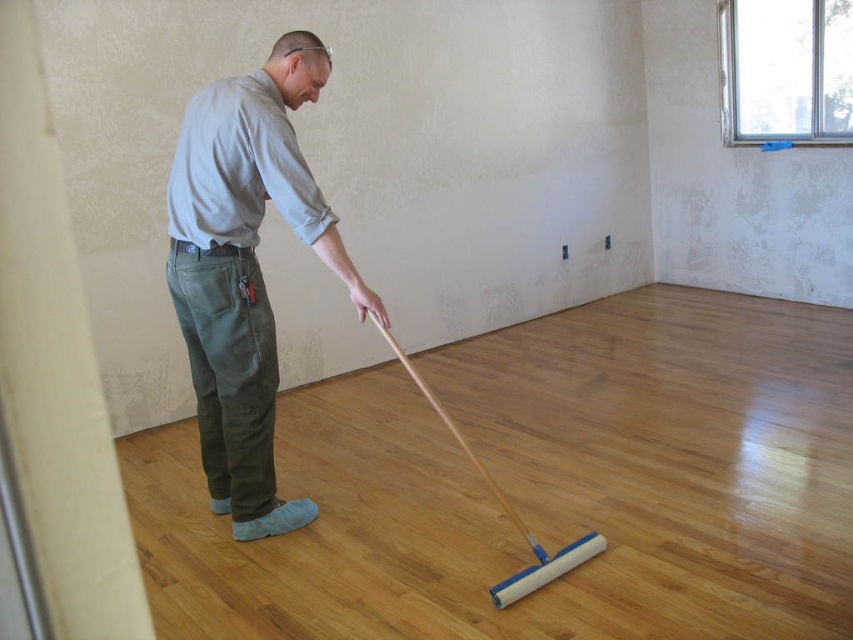
You are a contractor assessing the room for safety. The electrical outlets are located at the corner where the walls meet. You notice a point marked at coordinates (245, 269) which is the light gray cotton shirt at center. Is the man standing closer to the electrical outlets or the center of the room?

The point marked at coordinates (245, 269) indicates the light gray cotton shirt at center is at the center of the room. Since the electrical outlets are near the corner, the man is standing closer to the center of the room rather than the electrical outlets.